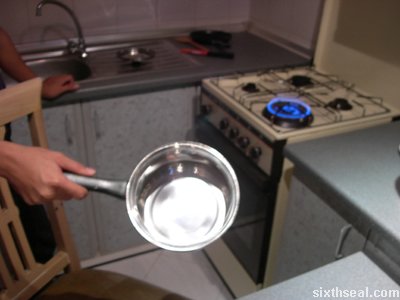
Image resolution: width=400 pixels, height=300 pixels. In order to click on saucepan in this screenshot , I will do `click(179, 196)`.